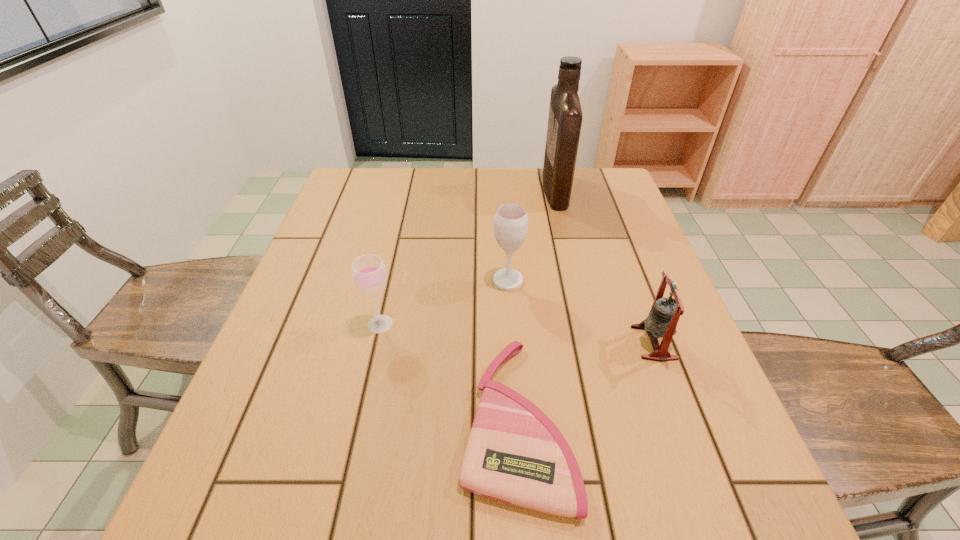
Where is `free spot between the rightmost object and the right wineglass`? The height and width of the screenshot is (540, 960). free spot between the rightmost object and the right wineglass is located at coordinates (581, 312).

Identify the location of object that is the third nearest to the wristlet. (664, 315).

Choose which object is the second nearest neighbor to the rightmost object. Please provide its 2D coordinates. Your answer should be formatted as a tuple, i.e. [(x, y)], where the tuple contains the x and y coordinates of a point satisfying the conditions above.

[(510, 227)]

Find the location of a particular element. The width and height of the screenshot is (960, 540). free region that satisfies the following two spatial constraints: 1. on the back side of the bell; 2. on the label side of the tallest object is located at coordinates (597, 190).

I want to click on vacant region that satisfies the following two spatial constraints: 1. on the front side of the left wineglass; 2. on the left side of the bell, so click(376, 342).